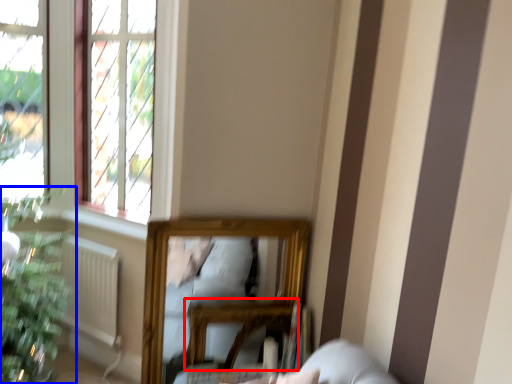
Question: Among these objects, which one is nearest to the camera, table (highlighted by a red box) or houseplant (highlighted by a blue box)?

Choices:
 (A) table
 (B) houseplant

Answer: (A)